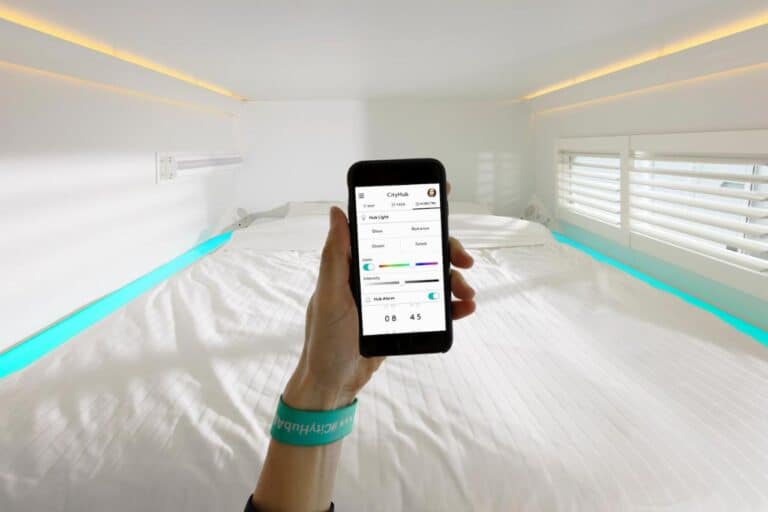
I want to click on white pillow, so click(507, 225), click(295, 237).